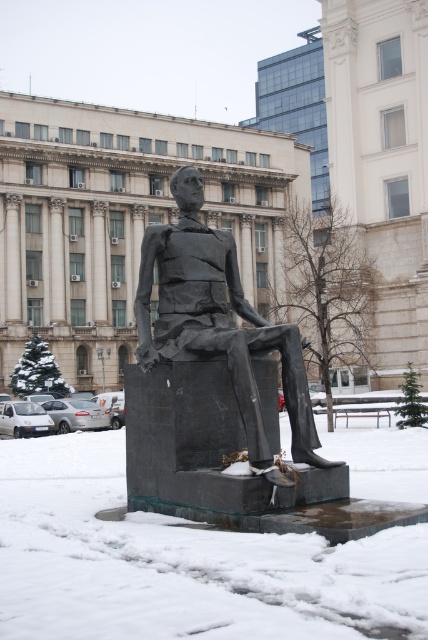
You are a photographer standing in front of the seated figure sculpture. You want to capture a closeup shot of the white frosty snow at lower center without including the sculpture in the frame. Based on the distance provided, can you estimate if you need to move closer or further away from the sculpture to achieve this?

The white frosty snow at lower center is 6.47 meters from the camera. To capture a closeup without including the sculpture, you would need to move closer to the snow, as the current distance may include the sculpture in the frame. However, precise adjustments depend on the camera lens and framing.

You are standing in the public square and want to take a photo of the sculpture. You notice two points on the sculpture base marked as point 1 at coordinates (86, 486) and point 2 at coordinates (297, 388). Which point is closer to you when looking at the sculpture?

Point 1 at coordinates (86, 486) is closer to you because it is further to the viewer than point 2 at coordinates (297, 388).

In the scene shown: You are a city planner assessing the public square. You need to place a new bench that requires at least 2 meters of clear space around it. Given the white frosty snow at lower center and the matte black statue at center, which area would allow the bench to be placed without encroaching on the statue?

The white frosty snow at lower center might be wider than the matte black statue at center, so placing the bench there would provide sufficient space around it.